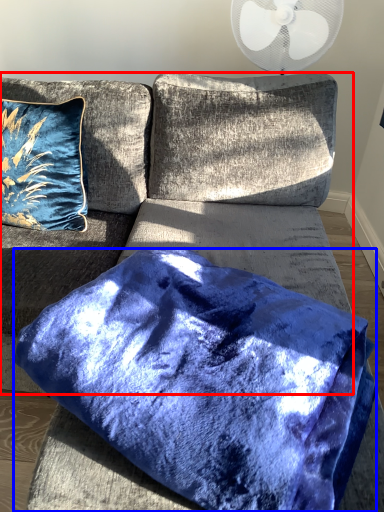
Question: Which object is closer to the camera taking this photo, couch (highlighted by a red box) or pillow (highlighted by a blue box)?

Choices:
 (A) couch
 (B) pillow

Answer: (A)